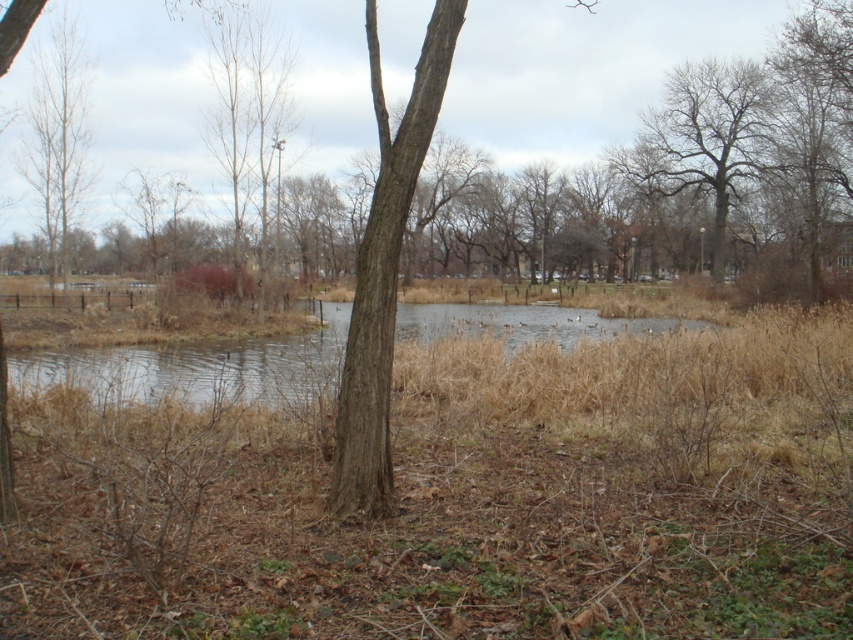
Question: Which point is closer to the camera?

Choices:
 (A) (746, 97)
 (B) (61, 184)

Answer: (B)

Question: Does bare branches tree at upper right have a larger size compared to bare wood tree at left?

Choices:
 (A) no
 (B) yes

Answer: (A)

Question: Which point appears closest to the camera in this image?

Choices:
 (A) (723, 182)
 (B) (71, 166)

Answer: (B)

Question: Is bare branches tree at upper right bigger than bare wood tree at left?

Choices:
 (A) no
 (B) yes

Answer: (A)

Question: From the image, what is the correct spatial relationship of bare branches tree at upper right in relation to bare wood tree at left?

Choices:
 (A) right
 (B) left

Answer: (A)